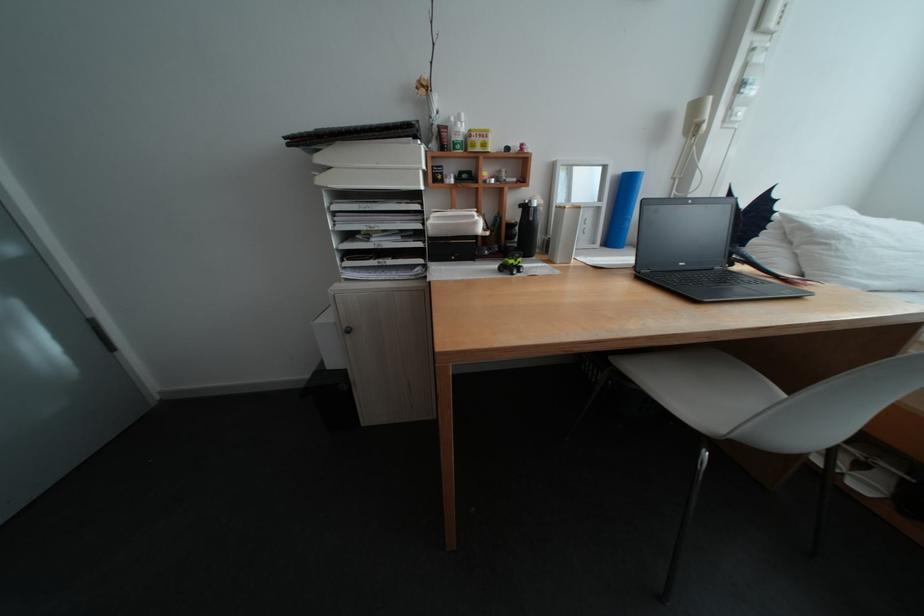
Which object does [511,264] point to?

It corresponds to the green toy vehicle in the image.